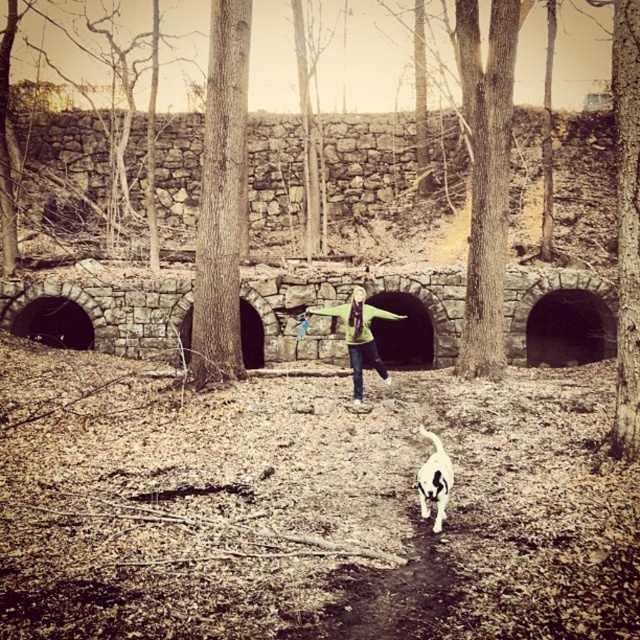
Based on the photo, you are a photographer trying to capture the scene with a wide angle lens. You want to ensure that both the green fleece jacket at center and the white fur dog at center are clearly visible. Based on their positions, which object is closer to the camera?

The green fleece jacket at center is positioned over the white fur dog at center, so the green fleece jacket at center is closer to the camera.

You are a photographer trying to capture a photo of the green fleece jacket at center and the white fur dog at center. The dog is moving towards the jacket. Based on their positions, which object is on the left side of the other?

The green fleece jacket at center is positioned on the left side of the white fur dog at center.

You are a photographer trying to capture a photo of both the green fleece jacket at center and the white fur dog at center. Since you want both subjects to be in focus, you need to adjust your camera to ensure depth of field. Which subject should you focus on to make sure both are sharp?

You should focus on the green fleece jacket at center because it is closer to the viewer than the white fur dog at center. By focusing on the closer subject, the depth of field will extend further back, increasing the chances of both being in focus.